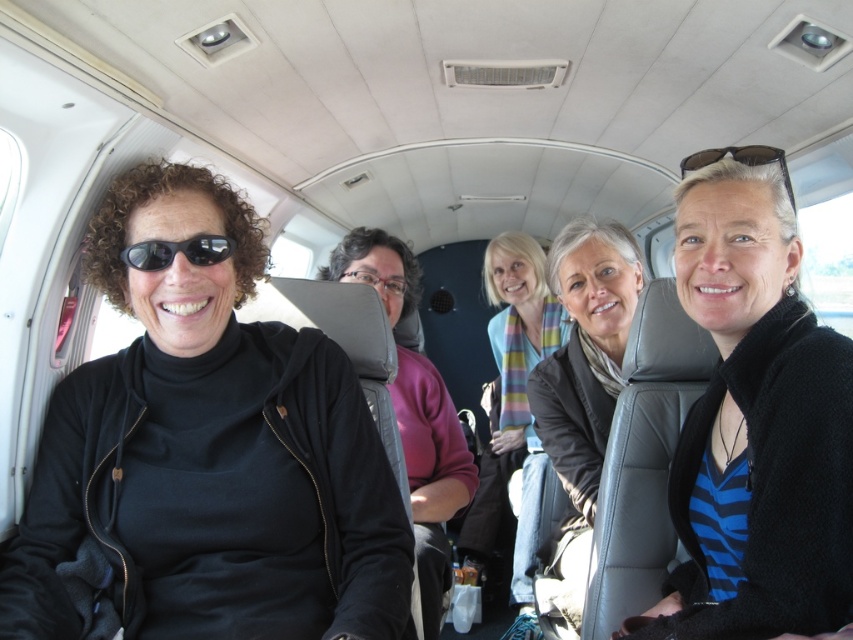
You are a flight attendant checking the overhead compartments. You need to store a large bag that requires at least 20 cm of vertical space. The compartment above the matte black jacket at center has 25 cm height, while the one above the black matte sunglasses at left has 18 cm. Which compartment should you choose?

The matte black jacket at center has an overhead compartment with 25 cm height, which meets the required 20 cm vertical space. Therefore, you should choose the compartment above the matte black jacket at center.

You are a flight attendant checking the overhead compartments. You notice the black knit sweater at center and the pink sweater at center. Which sweater is positioned higher in the cabin?

Result: The black knit sweater at center is positioned higher than the pink sweater at center.

You are a flight attendant on a small aircraft. You need to reach a point marked at coordinates point (x=558, y=465) in the cabin to secure an item. The maximum reach of your arm is 1.5 meters. Can you reach that point without moving your position?

The distance of point (x=558, y=465) from the camera is 1.84 meters, which is farther than your 1.5 meter reach. Therefore, you cannot reach the point without moving your position.